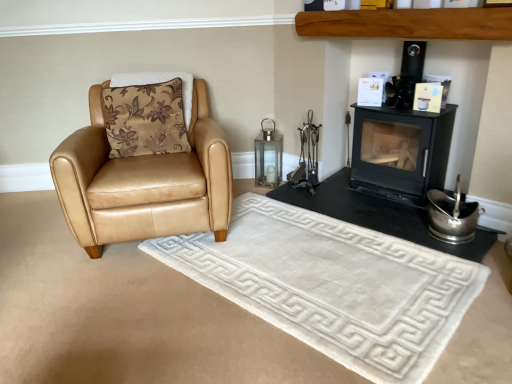
Locate an element on the screen. The image size is (512, 384). blank area to the left of white plush rug at center is located at coordinates (109, 297).